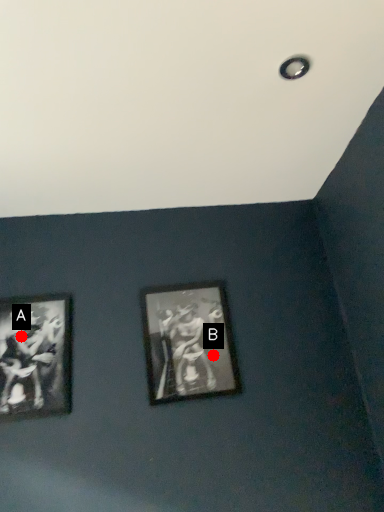
Question: Two points are circled on the image, labeled by A and B beside each circle. Which point is closer to the camera?

Choices:
 (A) A is closer
 (B) B is closer

Answer: (A)